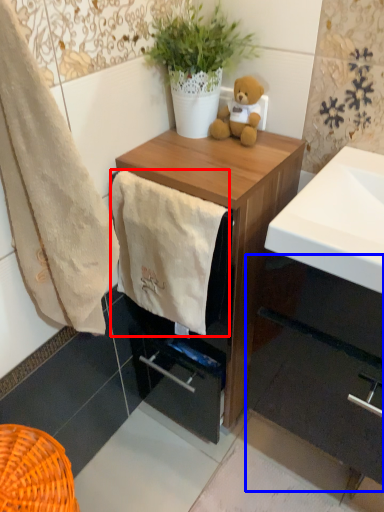
Question: Which point is further to the camera, towel/napkin (highlighted by a red box) or cabinetry (highlighted by a blue box)?

Choices:
 (A) towel/napkin
 (B) cabinetry

Answer: (B)